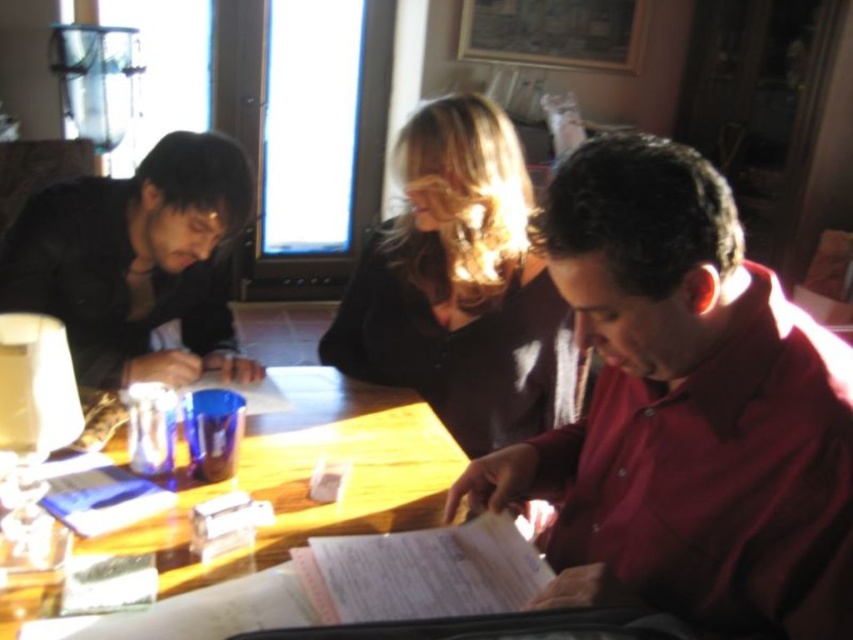
You are a person who needs to place a 35 cm wide book on the table. Can you fit it between the matte black shirt at left and the edge of the wooden table at center?

The matte black shirt at left is 34.83 centimeters from wooden table at center. Since the book is 35 cm wide, it will not fit as the distance is slightly less than the book width.

You are standing at the entrance of the room and want to hand a document to the person wearing the matte black sweater at center. Based on their position relative to the entrance, can you determine if you need to walk around the table to reach them?

The matte black sweater at center is located at point (460, 285), which is near the center of the table. Since you are at the entrance, you would likely need to walk around the table to reach them unless the entrance is directly adjacent to their position.

You are a tailor who needs to know the relative thickness of the matte black sweater at center and the wooden table at center. Which one is thinner?

The matte black sweater at center is thinner than the wooden table at center.